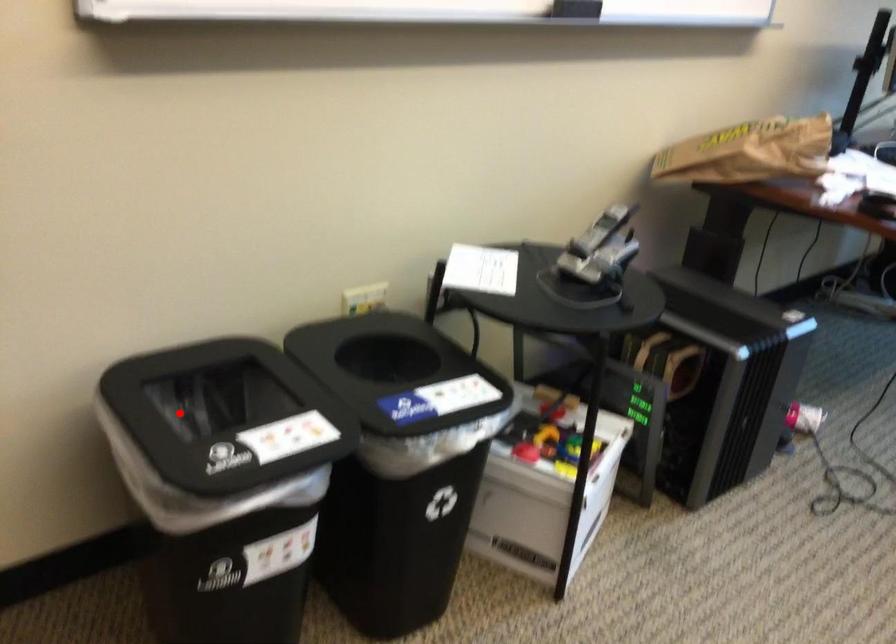
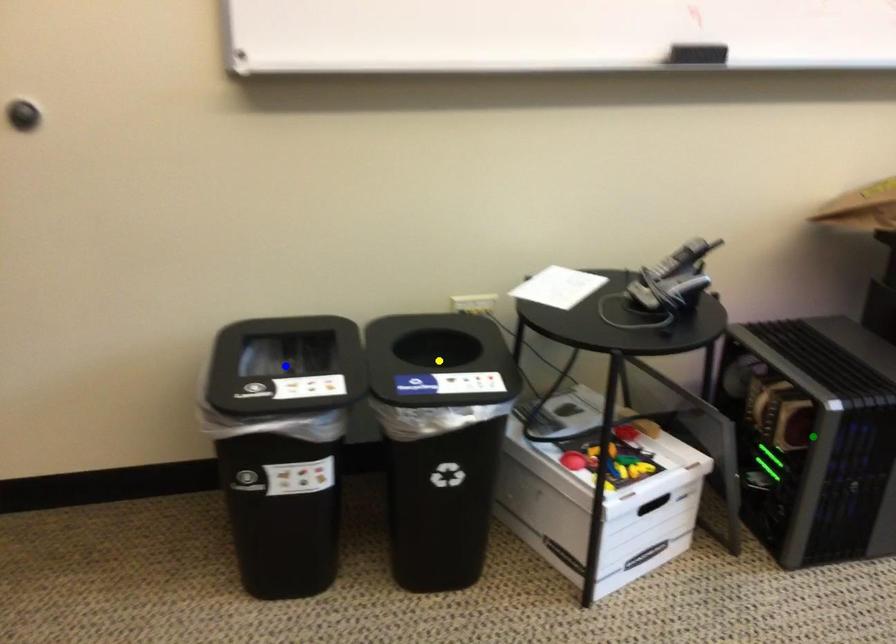
Question: I am providing you with two images of the same scene from different viewpoints. A red point is marked on the first image. You are given multiple points on the second image. Which point in image 2 is actually the same real-world point as the red point in image 1?

Choices:
 (A) yellow point
 (B) green point
 (C) blue point

Answer: (C)